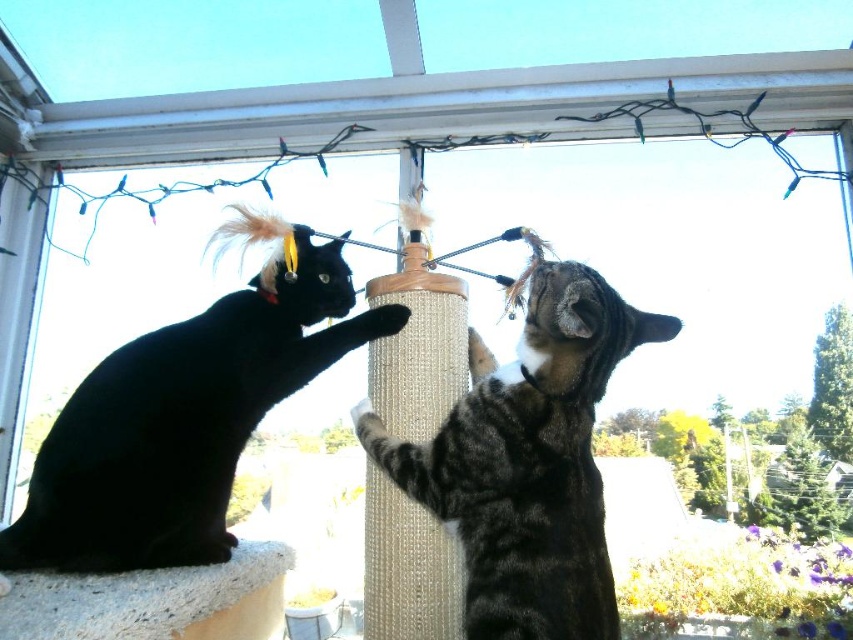
Question: Can you confirm if tabby fur cat at center is positioned to the left of white textured window sill at lower left?

Choices:
 (A) no
 (B) yes

Answer: (A)

Question: Considering the relative positions of tabby fur cat at center and white textured window sill at lower left in the image provided, where is tabby fur cat at center located with respect to white textured window sill at lower left?

Choices:
 (A) left
 (B) right

Answer: (B)

Question: Among these objects, which one is farthest from the camera?

Choices:
 (A) white textured window sill at lower left
 (B) tabby fur cat at center
 (C) shiny black cat at left

Answer: (C)

Question: Which point is closer to the camera taking this photo?

Choices:
 (A) (251, 420)
 (B) (583, 390)

Answer: (B)

Question: Which object is the closest to the shiny black cat at left?

Choices:
 (A) tabby fur cat at center
 (B) white textured window sill at lower left

Answer: (B)

Question: Is tabby fur cat at center wider than white textured window sill at lower left?

Choices:
 (A) yes
 (B) no

Answer: (A)